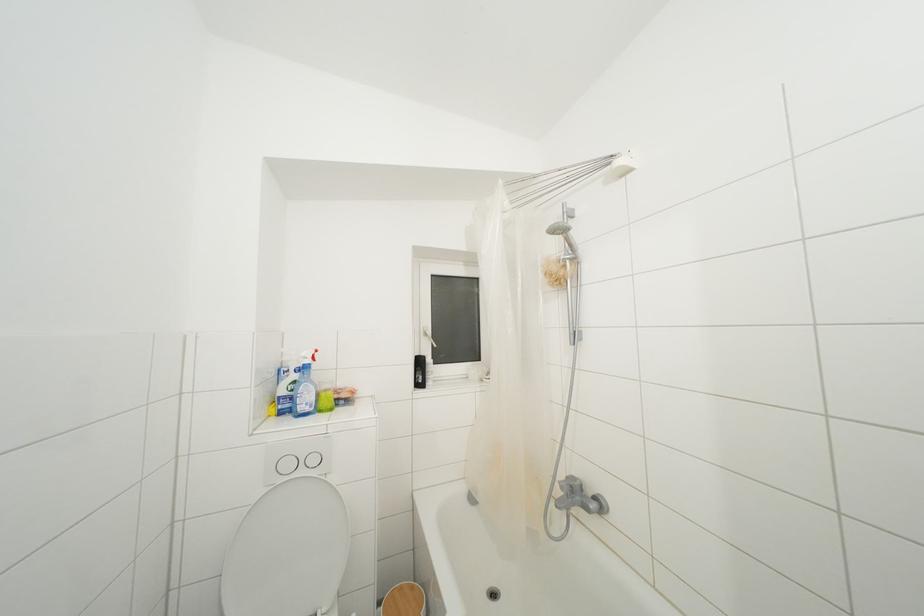
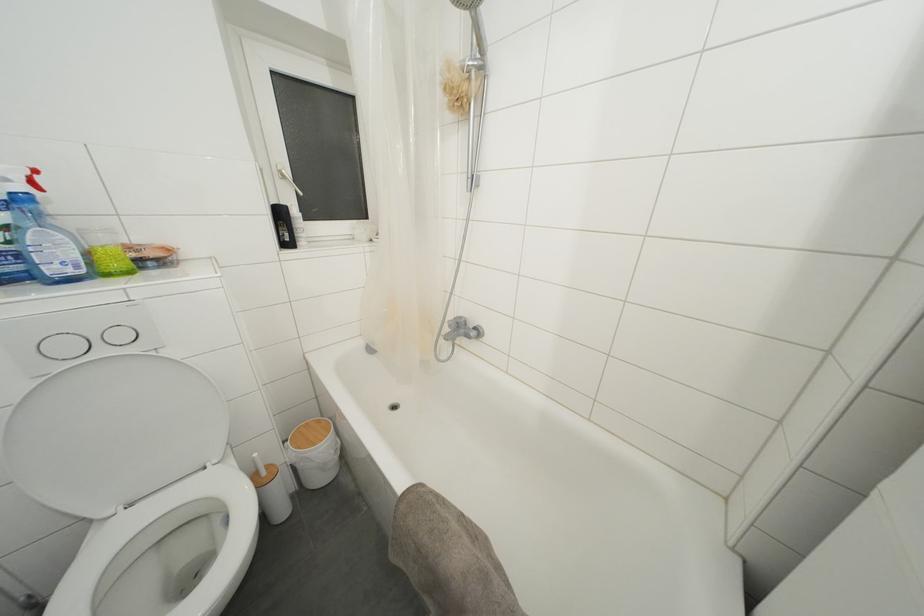
Locate, in the second image, the point that corresponds to the point at 572,245 in the first image.

(480, 31)